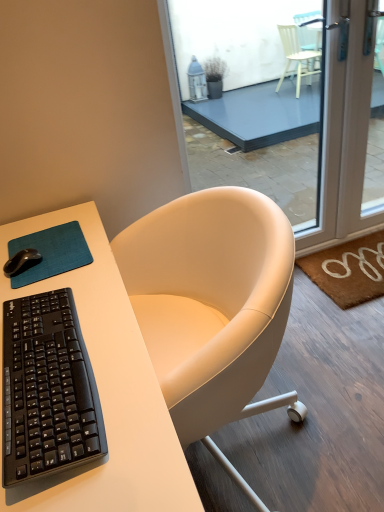
What do you see at coordinates (52, 252) in the screenshot?
I see `teal fabric mousepad at lower left` at bounding box center [52, 252].

Describe the element at coordinates (349, 270) in the screenshot. I see `brown coir doormat at lower right` at that location.

Where is `white leather chair at center`? The width and height of the screenshot is (384, 512). white leather chair at center is located at coordinates click(x=212, y=306).

In order to face transparent glass door at center, should I rotate leftwards or rightwards?

You should look right and rotate roughly 15.115 degrees.

Image resolution: width=384 pixels, height=512 pixels. What are the coordinates of `teal fabric mousepad at lower left` in the screenshot? It's located at (52, 252).

Is white matte desk at center to the left of brown coir doormat at lower right from the viewer's perspective?

Indeed, white matte desk at center is positioned on the left side of brown coir doormat at lower right.

Based on their sizes in the image, would you say white matte desk at center is bigger or smaller than brown coir doormat at lower right?

Considering their sizes, white matte desk at center takes up more space than brown coir doormat at lower right.

Between point (102, 288) and point (351, 301), which one is positioned behind?

The point (351, 301) is farther.

Based on the photo, looking at their sizes, would you say brown coir doormat at lower right is wider or thinner than transparent glass door at center?

brown coir doormat at lower right is wider than transparent glass door at center.

This screenshot has width=384, height=512. Find the location of `window located in front of the brown coir doormat at lower right`. window located in front of the brown coir doormat at lower right is located at coordinates point(253,97).

Does brown coir doormat at lower right have a smaller size compared to transparent glass door at center?

Indeed, brown coir doormat at lower right has a smaller size compared to transparent glass door at center.

From the picture: From a real-world perspective, is white matte desk at center below teal fabric mousepad at lower left?

Correct, in the physical world, white matte desk at center is lower than teal fabric mousepad at lower left.

From the image's perspective, is white matte desk at center located above teal fabric mousepad at lower left?

No, from the image's perspective, white matte desk at center is not on top of teal fabric mousepad at lower left.

Considering the relative positions of white matte desk at center and teal fabric mousepad at lower left in the image provided, is white matte desk at center to the left or to the right of teal fabric mousepad at lower left?

In the image, white matte desk at center appears on the right side of teal fabric mousepad at lower left.

Is white matte desk at center far away from teal fabric mousepad at lower left?

That's not correct — white matte desk at center is a little close to teal fabric mousepad at lower left.

Can you confirm if transparent glass door at center is smaller than brown coir doormat at lower right?

Incorrect, transparent glass door at center is not smaller in size than brown coir doormat at lower right.

Could you tell me if transparent glass door at center is turned towards brown coir doormat at lower right?

Yes, transparent glass door at center is turned towards brown coir doormat at lower right.

In the scene shown: From the image's perspective, which one is positioned higher, transparent glass door at center or brown coir doormat at lower right?

transparent glass door at center.

Looking at this image, is transparent glass door at center positioned far away from brown coir doormat at lower right?

Yes.

Which is more to the left, brown coir doormat at lower right or white matte desk at center?

From the viewer's perspective, white matte desk at center appears more on the left side.

Could you tell me if brown coir doormat at lower right is facing white matte desk at center?

No, brown coir doormat at lower right is not facing towards white matte desk at center.

Who is taller, brown coir doormat at lower right or white matte desk at center?

With more height is white matte desk at center.

Choose the correct answer: Is brown coir doormat at lower right inside white matte desk at center or outside it?

The correct answer is: outside.

Find the location of a particular element. The image size is (384, 512). computer keyboard that appears above the brown coir doormat at lower right (from a real-world perspective) is located at coordinates (47, 389).

Is brown coir doormat at lower right not close to black plastic keyboard at left?

brown coir doormat at lower right is positioned a significant distance from black plastic keyboard at left.

Can you confirm if brown coir doormat at lower right is positioned to the right of black plastic keyboard at left?

Correct, you'll find brown coir doormat at lower right to the right of black plastic keyboard at left.

Is black plastic keyboard at left surrounded by brown coir doormat at lower right?

No, black plastic keyboard at left is not inside brown coir doormat at lower right.

Consider the image. Who is taller, black matte mouse at upper left or teal fabric mousepad at lower left?

black matte mouse at upper left.

From the image's perspective, is black matte mouse at upper left over teal fabric mousepad at lower left?

Actually, black matte mouse at upper left appears below teal fabric mousepad at lower left in the image.

Considering the sizes of black matte mouse at upper left and teal fabric mousepad at lower left in the image, is black matte mouse at upper left wider or thinner than teal fabric mousepad at lower left?

Considering their sizes, black matte mouse at upper left looks slimmer than teal fabric mousepad at lower left.

Does point (14, 274) come closer to viewer compared to point (38, 234)?

Yes, point (14, 274) is closer to viewer.

Locate an element on the screen. The width and height of the screenshot is (384, 512). doormat below the white matte desk at center (from a real-world perspective) is located at coordinates (349, 270).

Identify the location of doormat behind the transparent glass door at center. (349, 270).

From the image, which object appears to be farther from black matte mouse at upper left, transparent glass door at center or white leather chair at center?

transparent glass door at center is positioned further to the anchor black matte mouse at upper left.

Considering their positions, is white matte desk at center positioned further to black matte mouse at upper left than transparent glass door at center?

Among the two, transparent glass door at center is located further to black matte mouse at upper left.

Looking at the image, which one is located further to brown coir doormat at lower right, transparent glass door at center or black matte mouse at upper left?

transparent glass door at center is positioned further to the anchor brown coir doormat at lower right.

Based on their spatial positions, is black matte mouse at upper left or brown coir doormat at lower right further from transparent glass door at center?

Based on the image, black matte mouse at upper left appears to be further to transparent glass door at center.

Based on their spatial positions, is white leather chair at center or black matte mouse at upper left further from teal fabric mousepad at lower left?

Based on the image, white leather chair at center appears to be further to teal fabric mousepad at lower left.

From the image, which object appears to be nearer to teal fabric mousepad at lower left, black matte mouse at upper left or white leather chair at center?

The object closer to teal fabric mousepad at lower left is black matte mouse at upper left.

Estimate the real-world distances between objects in this image. Which object is closer to white leather chair at center, brown coir doormat at lower right or transparent glass door at center?

brown coir doormat at lower right.

When comparing their distances from teal fabric mousepad at lower left, does white leather chair at center or transparent glass door at center seem further?

The object further to teal fabric mousepad at lower left is transparent glass door at center.

I want to click on chair situated between teal fabric mousepad at lower left and transparent glass door at center from left to right, so click(212, 306).

The height and width of the screenshot is (512, 384). Identify the location of computer keyboard located between black matte mouse at upper left and brown coir doormat at lower right in the left-right direction. (47, 389).

Locate an element on the screen. The height and width of the screenshot is (512, 384). computer keyboard between teal fabric mousepad at lower left and white leather chair at center in the horizontal direction is located at coordinates (47, 389).

You are a GUI agent. You are given a task and a screenshot of the screen. Output one action in this format:
    pyautogui.click(x=<x>, y=<y>)
    Task: Click on the computer keyboard situated between black matte mouse at upper left and transparent glass door at center from left to right
    The image size is (384, 512).
    Given the screenshot: What is the action you would take?
    pyautogui.click(x=47, y=389)